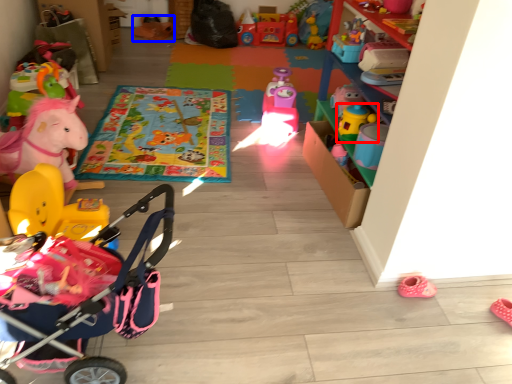
Question: Which object is closer to the camera taking this photo, toy (highlighted by a red box) or toy (highlighted by a blue box)?

Choices:
 (A) toy
 (B) toy

Answer: (A)